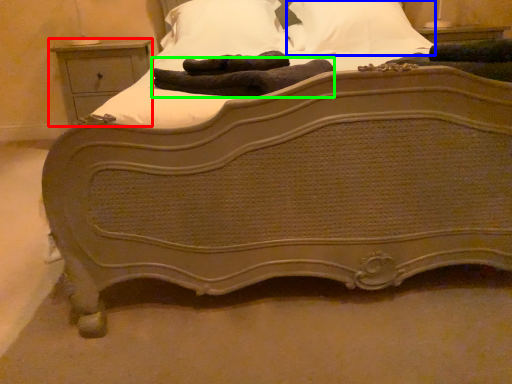
Question: Estimate the real-world distances between objects in this image. Which object is farther from nightstand (highlighted by a red box), pillow (highlighted by a blue box) or material (highlighted by a green box)?

Choices:
 (A) pillow
 (B) material

Answer: (B)